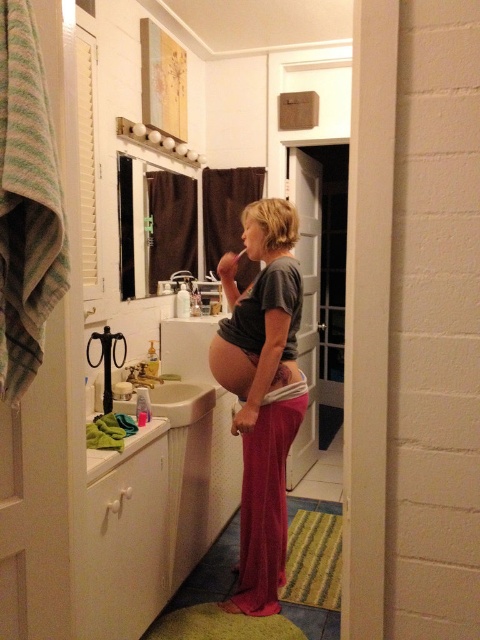
Question: Which object appears farthest from the camera in this image?

Choices:
 (A) white glossy sink at lower left
 (B) matte gray shirt at center
 (C) brushed metal faucet at sink left

Answer: (C)

Question: Observing the image, what is the correct spatial positioning of matte gray shirt at center in reference to brushed metal faucet at sink left?

Choices:
 (A) above
 (B) below

Answer: (B)

Question: Can you confirm if matte gray shirt at center is thinner than white glossy sink at lower left?

Choices:
 (A) yes
 (B) no

Answer: (A)

Question: Which of these objects is positioned closest to the brushed metal faucet at sink left?

Choices:
 (A) matte gray shirt at center
 (B) white glossy sink at lower left

Answer: (B)

Question: Which point is farther from the camera taking this photo?

Choices:
 (A) (252, 449)
 (B) (182, 412)

Answer: (B)

Question: Does matte gray shirt at center have a larger size compared to brushed metal faucet at sink left?

Choices:
 (A) no
 (B) yes

Answer: (B)